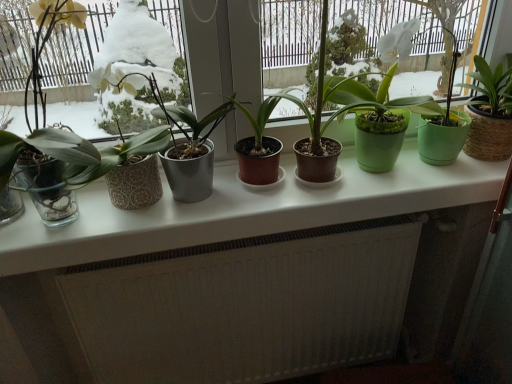
Question: Is brown matte pot at center, which is the third houseplant from right to left, aimed at green matte pot at center, the first houseplant in the right-to-left sequence?

Choices:
 (A) yes
 (B) no

Answer: (B)

Question: Is brown matte pot at center, placed as the 2th houseplant when sorted from left to right, positioned with its back to green matte pot at center, the first houseplant in the right-to-left sequence?

Choices:
 (A) yes
 (B) no

Answer: (B)

Question: Is brown matte pot at center, which is the third houseplant from right to left, not within green matte pot at center, the first houseplant in the right-to-left sequence?

Choices:
 (A) yes
 (B) no

Answer: (A)

Question: Considering the relative sizes of brown matte pot at center, placed as the 2th houseplant when sorted from left to right, and green matte pot at center, the first houseplant in the right-to-left sequence, in the image provided, is brown matte pot at center, placed as the 2th houseplant when sorted from left to right, wider than green matte pot at center, the first houseplant in the right-to-left sequence,?

Choices:
 (A) yes
 (B) no

Answer: (B)

Question: From a real-world perspective, is brown matte pot at center, placed as the 2th houseplant when sorted from left to right, positioned under green matte pot at center, the first houseplant in the right-to-left sequence, based on gravity?

Choices:
 (A) yes
 (B) no

Answer: (B)

Question: Is brown matte pot at center, which is the third houseplant from right to left, smaller than green matte pot at center, which appears as the 4th houseplant when viewed from the left?

Choices:
 (A) no
 (B) yes

Answer: (B)

Question: Does white textured radiator at lower center have a lesser width compared to matte black pot at center, the second houseplant viewed from the right?

Choices:
 (A) no
 (B) yes

Answer: (A)

Question: Can you confirm if white textured radiator at lower center is taller than matte black pot at center, the second houseplant viewed from the right?

Choices:
 (A) no
 (B) yes

Answer: (B)

Question: Is white textured radiator at lower center at the left side of matte black pot at center, the 3th houseplant viewed from the left?

Choices:
 (A) no
 (B) yes

Answer: (B)

Question: Is white textured radiator at lower center directly adjacent to matte black pot at center, the second houseplant viewed from the right?

Choices:
 (A) yes
 (B) no

Answer: (B)

Question: Can you confirm if white textured radiator at lower center is positioned to the right of matte black pot at center, the second houseplant viewed from the right?

Choices:
 (A) no
 (B) yes

Answer: (A)

Question: From the image's perspective, is white textured radiator at lower center under matte black pot at center, the second houseplant viewed from the right?

Choices:
 (A) yes
 (B) no

Answer: (A)

Question: From a real-world perspective, is transparent glass window at left under matte black pot at center, the 3th houseplant viewed from the left?

Choices:
 (A) no
 (B) yes

Answer: (A)